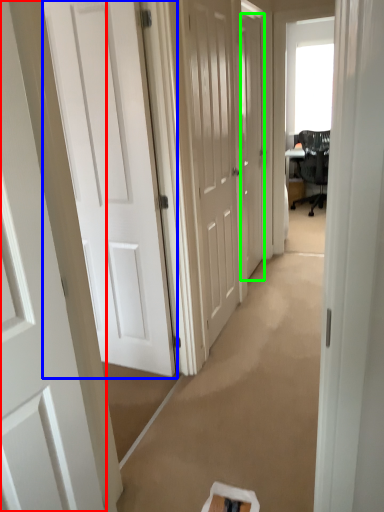
Question: Which object is the closest to the door (highlighted by a red box)? Choose among these: door (highlighted by a blue box) or door (highlighted by a green box).

Choices:
 (A) door
 (B) door

Answer: (A)